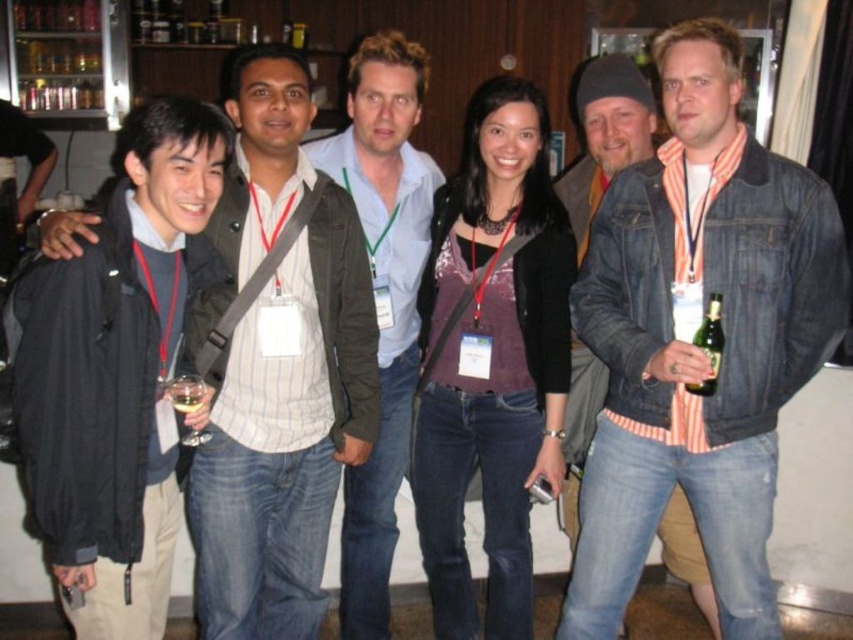
You are at a social event and notice two jackets in the image. The first is a matte black jacket at left, and the second is a black matte jacket at left. Which one is positioned higher up?

The matte black jacket at left is positioned higher up than the black matte jacket at left.

Looking at this image, you are standing in front of the group photo and notice two jackets labeled as matte black jacket at left and black matte jacket at left. Which one is positioned closer to the front of the group?

The matte black jacket at left is closer to the front because the black matte jacket at left is behind it.

You need to decide which jacket to take for a casual evening out. Both the denim jacket at right and the matte black jacket at left are options. Based on their sizes shown in the image, which one would be more suitable if you prefer a larger jacket?

The denim jacket at right is bigger than the matte black jacket at left, so it would be more suitable if you prefer a larger jacket.